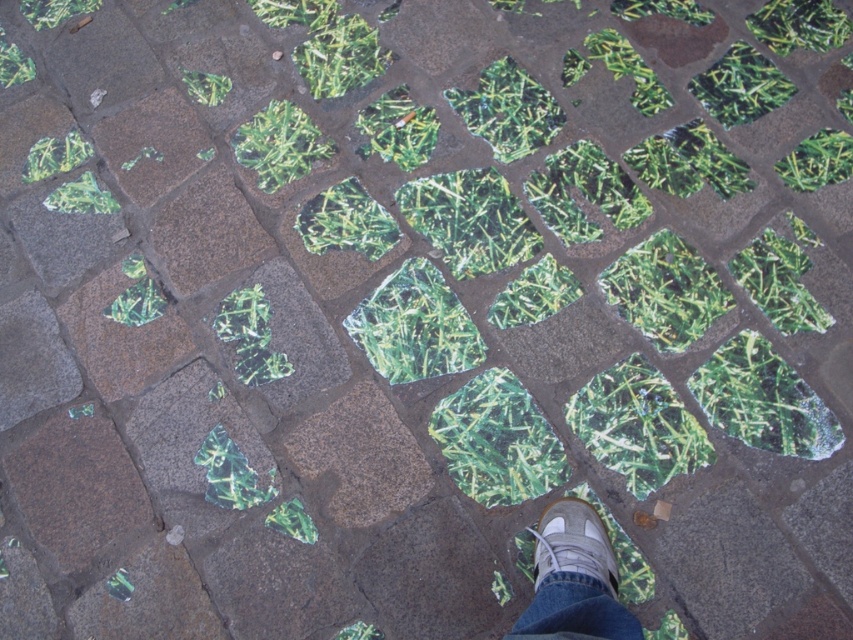
Which is in front, point (601, 596) or point (537, 538)?

Point (601, 596) is more forward.

Can you confirm if gray suede shoe at center is wider than light brown suede shoe at center?

Yes.

Locate an element on the screen. The height and width of the screenshot is (640, 853). gray suede shoe at center is located at coordinates (573, 579).